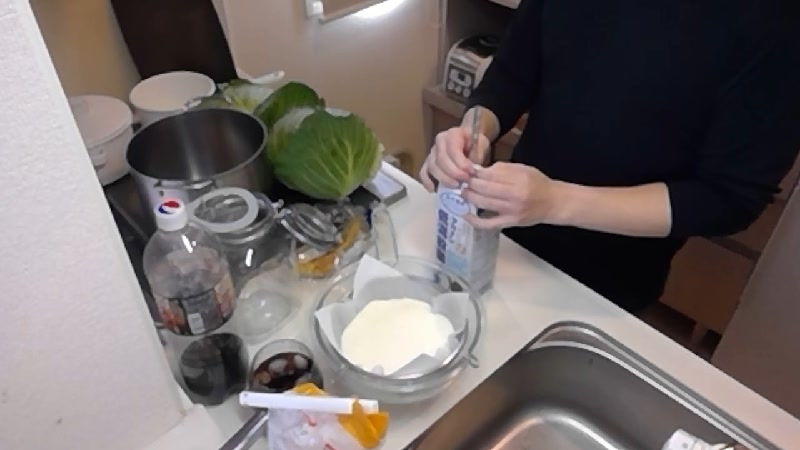
Locate an element on the screen. The image size is (800, 450). sink is located at coordinates (569, 444).